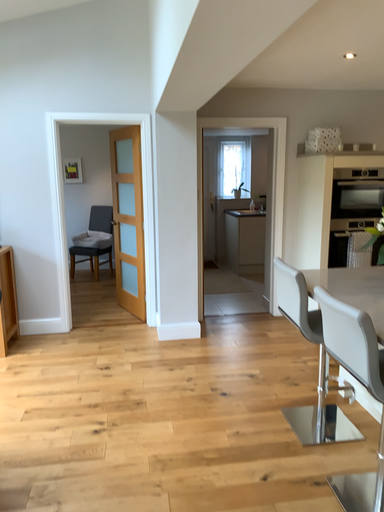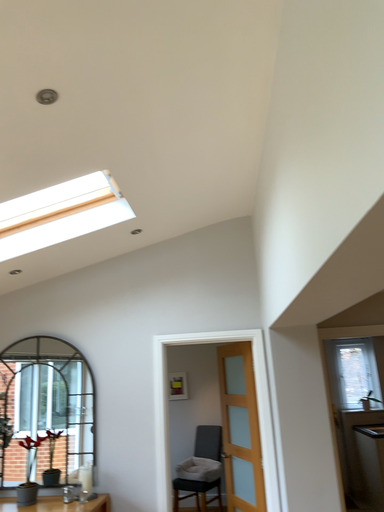
Question: Which way did the camera rotate in the video?

Choices:
 (A) rotated left
 (B) rotated right

Answer: (A)